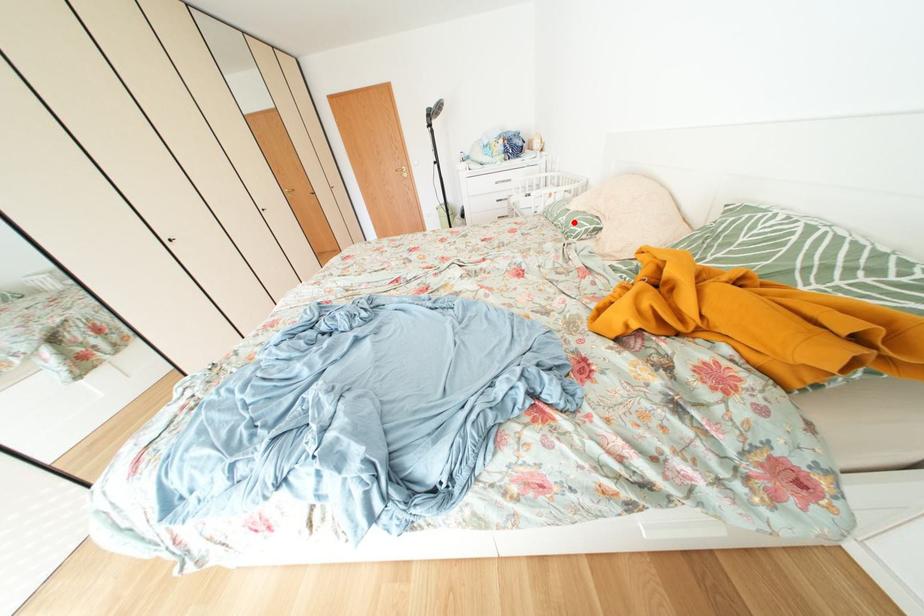
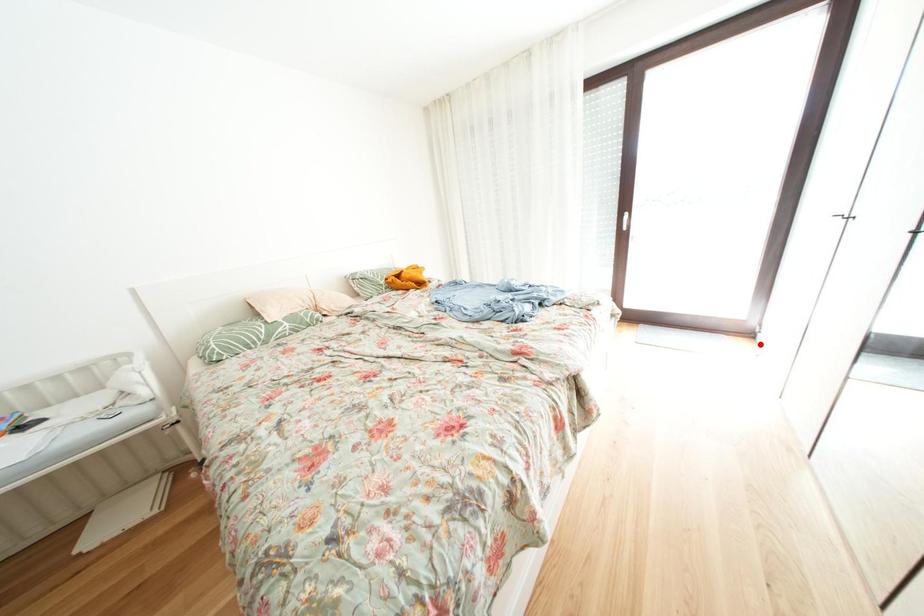
I am providing you with two images of the same scene from different viewpoints. A red point is marked on the first image and another point is marked on the second image. Is the red point in image1 aligned with the point shown in image2?

No